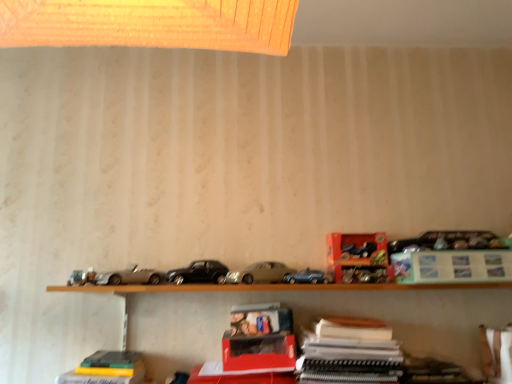
Question: From the image's perspective, is wooden shelf at lower center located above metallic blue car at center, the first model car when ordered from right to left?

Choices:
 (A) no
 (B) yes

Answer: (A)

Question: Could you tell me if wooden shelf at lower center is turned towards metallic blue car at center, the 2th model car when ordered from left to right?

Choices:
 (A) no
 (B) yes

Answer: (A)

Question: Is wooden shelf at lower center facing away from metallic blue car at center, the first model car when ordered from right to left?

Choices:
 (A) no
 (B) yes

Answer: (A)

Question: Is wooden shelf at lower center with metallic blue car at center, the first model car when ordered from right to left?

Choices:
 (A) yes
 (B) no

Answer: (B)

Question: Is wooden shelf at lower center positioned in front of metallic blue car at center, the 2th model car when ordered from left to right?

Choices:
 (A) yes
 (B) no

Answer: (A)

Question: Considering the relative sizes of wooden shelf at lower center and metallic blue car at center, the first model car when ordered from right to left, in the image provided, is wooden shelf at lower center thinner than metallic blue car at center, the first model car when ordered from right to left,?

Choices:
 (A) yes
 (B) no

Answer: (B)

Question: Is black metallic car at center, which is the 1th car from left to right, smaller than metallic blue car at center, the first model car when ordered from right to left?

Choices:
 (A) no
 (B) yes

Answer: (A)

Question: Does black metallic car at center, the second car positioned from the right, turn towards metallic blue car at center, the 2th model car when ordered from left to right?

Choices:
 (A) yes
 (B) no

Answer: (B)

Question: Is black metallic car at center, the second car positioned from the right, shorter than metallic blue car at center, the 2th model car when ordered from left to right?

Choices:
 (A) yes
 (B) no

Answer: (B)

Question: From a real-world perspective, does black metallic car at center, the second car positioned from the right, stand above metallic blue car at center, the first model car when ordered from right to left?

Choices:
 (A) yes
 (B) no

Answer: (A)

Question: From the image's perspective, is black metallic car at center, the second car positioned from the right, above metallic blue car at center, the first model car when ordered from right to left?

Choices:
 (A) yes
 (B) no

Answer: (A)

Question: Is black metallic car at center, the second car positioned from the right, not close to metallic blue car at center, the first model car when ordered from right to left?

Choices:
 (A) yes
 (B) no

Answer: (B)

Question: From a real-world perspective, is metallic blue car at upper right, marked as the 2th toy in a bottom-to-top arrangement, beneath matte silver car at center, which is the second car from left to right?

Choices:
 (A) yes
 (B) no

Answer: (B)